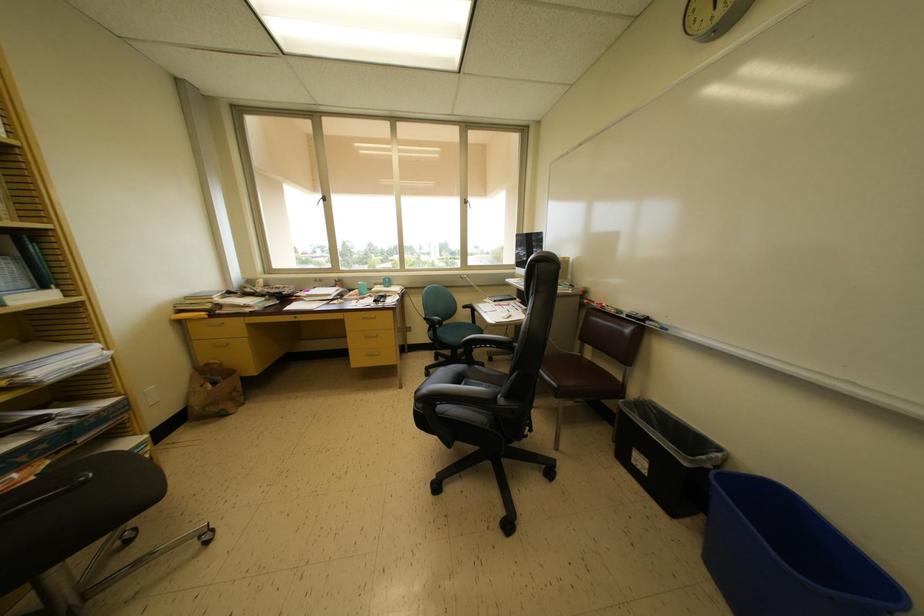
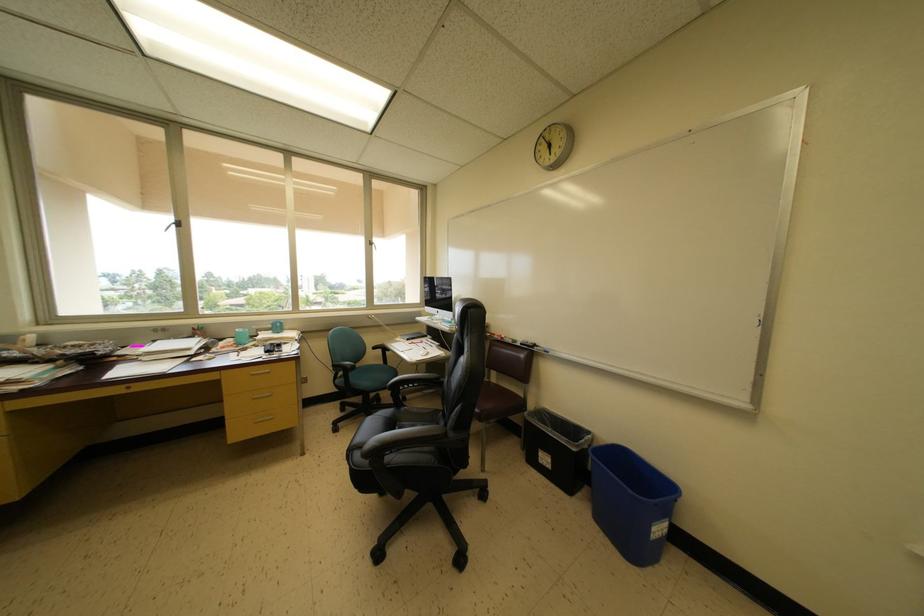
Question: What movement of the cameraman would produce the second image?

Choices:
 (A) Left
 (B) Right
 (C) Forward
 (D) Backward

Answer: (A)